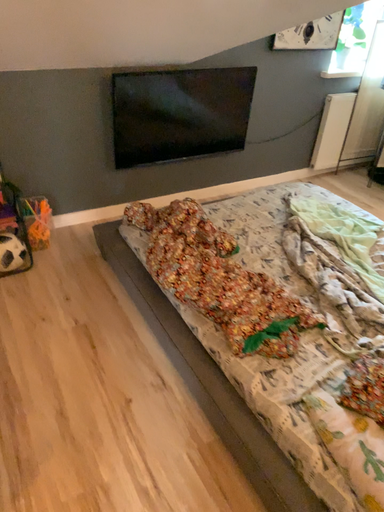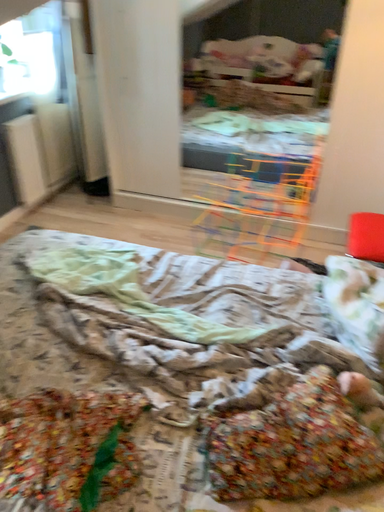
Question: How did the camera likely rotate when shooting the video?

Choices:
 (A) rotated right
 (B) rotated left

Answer: (A)